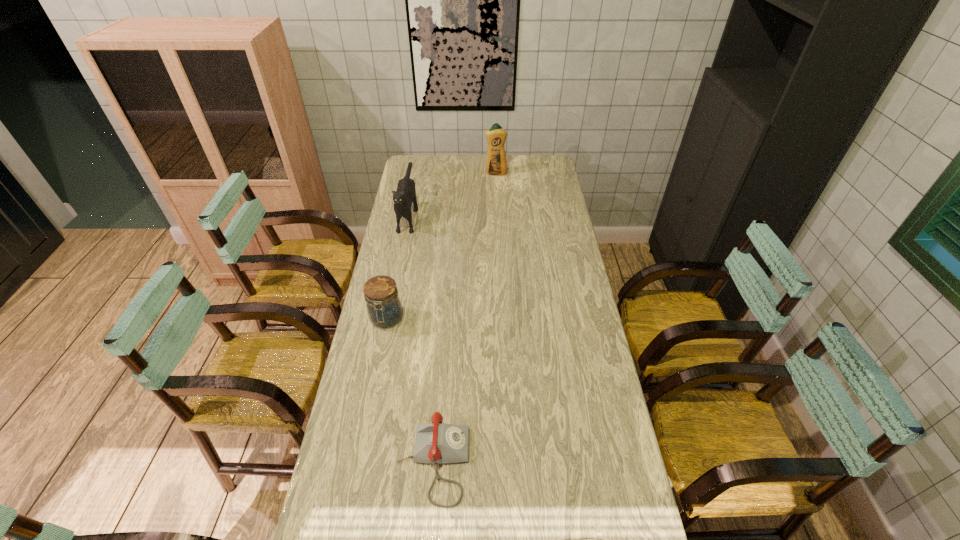
At what (x,y) coordinates should I click in order to perform the action: click on vacant area that lies between the detergent and the second nearest object. Please return your answer as a coordinate pair (x, y). This screenshot has height=540, width=960. Looking at the image, I should click on (441, 246).

Locate an element on the screen. The width and height of the screenshot is (960, 540). empty space between the second farthest object and the farthest object is located at coordinates (452, 193).

The height and width of the screenshot is (540, 960). Find the location of `vacant area that lies between the rightmost object and the second tallest object`. vacant area that lies between the rightmost object and the second tallest object is located at coordinates (452, 193).

Locate an element on the screen. The image size is (960, 540). free area in between the second nearest object and the detergent is located at coordinates (441, 246).

Image resolution: width=960 pixels, height=540 pixels. What are the coordinates of `free space between the jar and the nearest object` in the screenshot? It's located at (410, 391).

Locate an element on the screen. unoccupied area between the third farthest object and the second farthest object is located at coordinates (397, 266).

Locate which object ranks second in proximity to the nearest object. Please provide its 2D coordinates. Your answer should be formatted as a tuple, i.e. [(x, y)], where the tuple contains the x and y coordinates of a point satisfying the conditions above.

[(405, 195)]

This screenshot has height=540, width=960. I want to click on object that is the closest one to the telephone, so click(383, 304).

You are a GUI agent. You are given a task and a screenshot of the screen. Output one action in this format:
    pyautogui.click(x=<x>, y=<y>)
    Task: Click on the free region that satisfies the following two spatial constraints: 1. on the label of the tallest object; 2. on the dial of the telephone
    
    Given the screenshot: What is the action you would take?
    pyautogui.click(x=510, y=462)